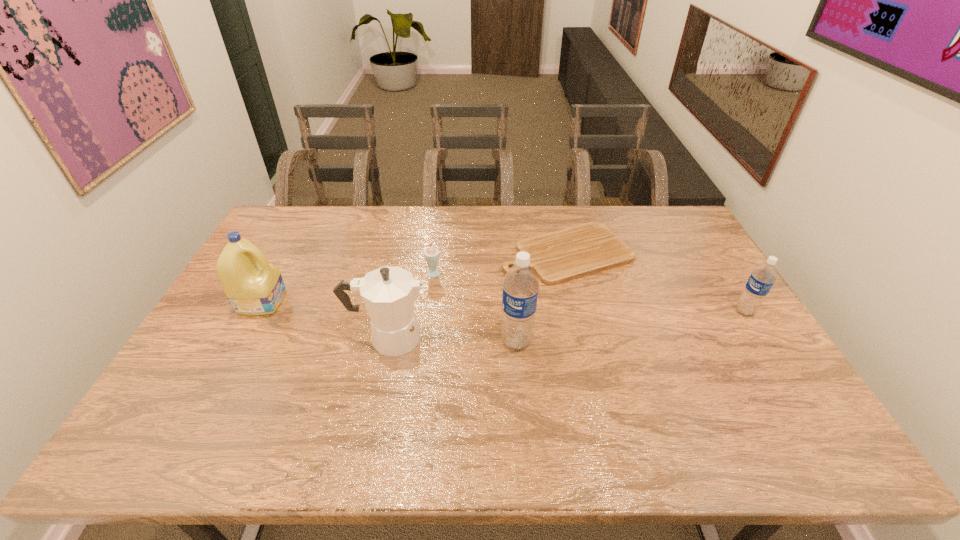
Identify the location of vacant area situated 0.220m on the straw side of the milkshake. The width and height of the screenshot is (960, 540). (429, 329).

Locate an element on the screen. vacant space located 0.330m on the left of the shortest object is located at coordinates (404, 253).

Locate an element on the screen. This screenshot has height=540, width=960. vacant space located at the spout of the coffeepot is located at coordinates (553, 338).

The width and height of the screenshot is (960, 540). I want to click on free space located 0.110m on the label of the detergent, so click(320, 301).

Where is `object that is at the far edge`? This screenshot has width=960, height=540. object that is at the far edge is located at coordinates (556, 257).

Identify the location of object that is at the left edge. (253, 286).

This screenshot has height=540, width=960. In order to click on object that is at the right edge in this screenshot , I will do [761, 280].

Locate an element on the screen. Image resolution: width=960 pixels, height=540 pixels. vacant space at the far edge of the desktop is located at coordinates (516, 214).

In the image, there is a desktop. Identify the location of free space at the near edge. This screenshot has width=960, height=540. (707, 402).

This screenshot has height=540, width=960. I want to click on free region at the left edge, so click(198, 367).